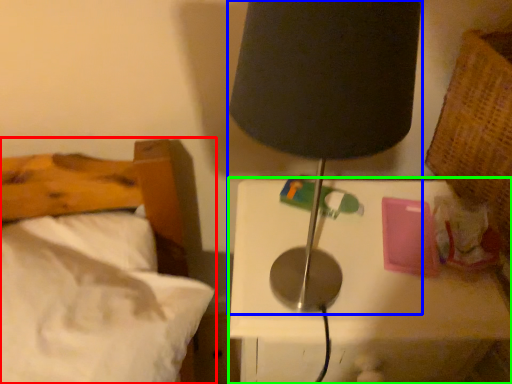
Question: Based on their relative distances, which object is farther from bed (highlighted by a red box)? Choose from lamp (highlighted by a blue box) and nightstand (highlighted by a green box).

Choices:
 (A) lamp
 (B) nightstand

Answer: (A)